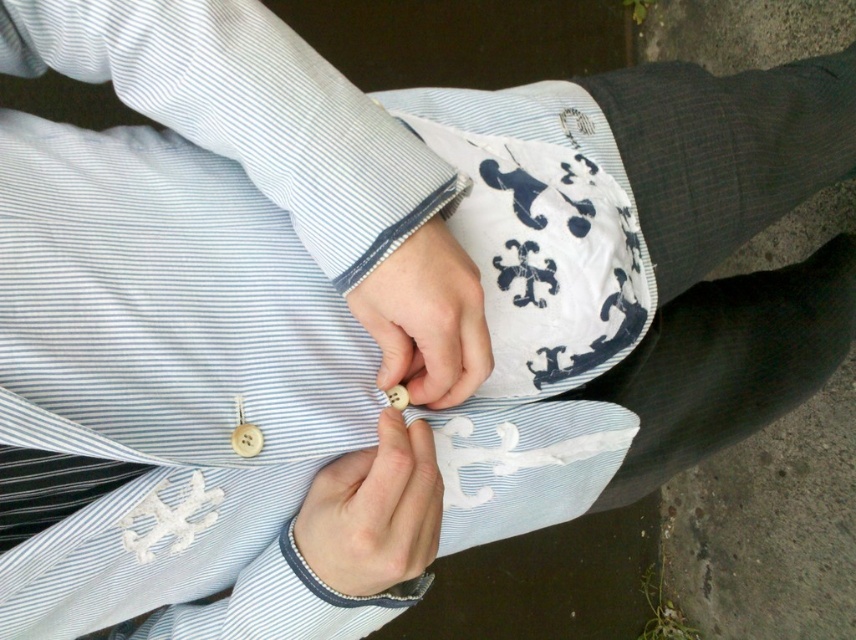
Question: Which of the following is the closest to the observer?

Choices:
 (A) (449, 257)
 (B) (366, 541)

Answer: (B)

Question: Among these points, which one is nearest to the camera?

Choices:
 (A) (444, 296)
 (B) (420, 538)

Answer: (A)

Question: Is white matte button at center smaller than wooden button at center?

Choices:
 (A) yes
 (B) no

Answer: (B)

Question: Does white matte button at center have a lesser width compared to wooden button at center?

Choices:
 (A) no
 (B) yes

Answer: (A)

Question: In this image, where is white matte button at center located relative to wooden button at center?

Choices:
 (A) right
 (B) left

Answer: (B)